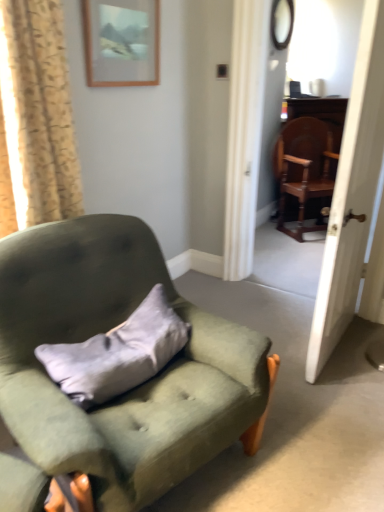
Question: From a real-world perspective, does wooden polished chair at right, the first chair from the back, sit lower than gray suede pillow at center?

Choices:
 (A) no
 (B) yes

Answer: (A)

Question: Is wooden polished chair at right, acting as the 2th chair starting from the front, outside of gray suede pillow at center?

Choices:
 (A) yes
 (B) no

Answer: (A)

Question: Can you confirm if wooden polished chair at right, the first chair from the back, is wider than gray suede pillow at center?

Choices:
 (A) no
 (B) yes

Answer: (B)

Question: Is gray suede pillow at center at the back of wooden polished chair at right, which ranks as the first chair in right-to-left order?

Choices:
 (A) no
 (B) yes

Answer: (A)

Question: From a real-world perspective, is wooden polished chair at right, the 2th chair from the left, over gray suede pillow at center?

Choices:
 (A) no
 (B) yes

Answer: (B)

Question: Considering the positions of point (104, 20) and point (367, 9), is point (104, 20) closer or farther from the camera than point (367, 9)?

Choices:
 (A) farther
 (B) closer

Answer: (A)

Question: Considering the positions of matte wooden picture frame at upper center and wooden screen door at right in the image, is matte wooden picture frame at upper center wider or thinner than wooden screen door at right?

Choices:
 (A) thin
 (B) wide

Answer: (A)

Question: From a real-world perspective, is matte wooden picture frame at upper center physically located above or below wooden screen door at right?

Choices:
 (A) below
 (B) above

Answer: (B)

Question: Is matte wooden picture frame at upper center taller or shorter than wooden screen door at right?

Choices:
 (A) tall
 (B) short

Answer: (B)

Question: In terms of width, does gray suede pillow at center look wider or thinner when compared to beige floral fabric curtain at left?

Choices:
 (A) wide
 (B) thin

Answer: (B)

Question: From the image's perspective, is gray suede pillow at center positioned above or below beige floral fabric curtain at left?

Choices:
 (A) below
 (B) above

Answer: (A)

Question: Is gray suede pillow at center inside or outside of beige floral fabric curtain at left?

Choices:
 (A) outside
 (B) inside

Answer: (A)

Question: Considering the positions of point (134, 317) and point (43, 30), is point (134, 317) closer or farther from the camera than point (43, 30)?

Choices:
 (A) closer
 (B) farther

Answer: (B)

Question: From the image's perspective, is beige floral fabric curtain at left located above or below matte wooden picture frame at upper center?

Choices:
 (A) below
 (B) above

Answer: (A)

Question: Considering the positions of beige floral fabric curtain at left and matte wooden picture frame at upper center in the image, is beige floral fabric curtain at left bigger or smaller than matte wooden picture frame at upper center?

Choices:
 (A) small
 (B) big

Answer: (B)